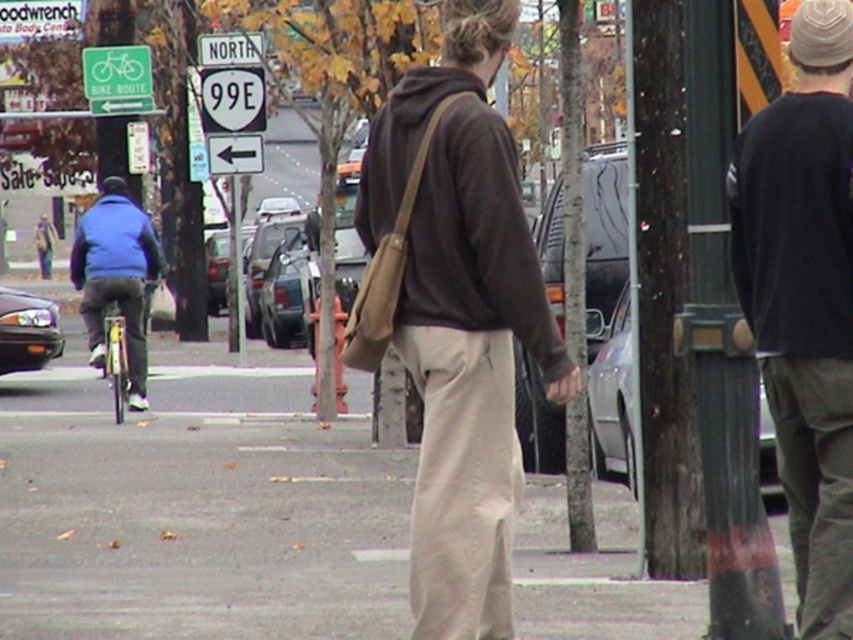
Can you confirm if khaki pants at center is taller than black cotton sweater at upper right?

In fact, khaki pants at center may be shorter than black cotton sweater at upper right.

Describe the element at coordinates (456, 314) in the screenshot. The width and height of the screenshot is (853, 640). I see `khaki pants at center` at that location.

Identify the location of khaki pants at center. (456, 314).

Consider the image. Is black cotton sweater at upper right smaller than blue fleece jacket at left?

Yes, black cotton sweater at upper right is smaller than blue fleece jacket at left.

Does point (752, 157) come closer to viewer compared to point (135, 257)?

Yes, it is.

Which is in front, point (816, 561) or point (128, 356)?

Point (816, 561) is in front.

Locate an element on the screen. black cotton sweater at upper right is located at coordinates (x=804, y=300).

Does brown leather bag at center appear over black cotton sweater at upper right?

Actually, brown leather bag at center is below black cotton sweater at upper right.

Does brown leather bag at center have a larger size compared to black cotton sweater at upper right?

Correct, brown leather bag at center is larger in size than black cotton sweater at upper right.

Is point (781, 138) closer to viewer compared to point (790, 355)?

Yes, point (781, 138) is closer to viewer.

In order to click on brown leather bag at center in this screenshot , I will do `click(799, 298)`.